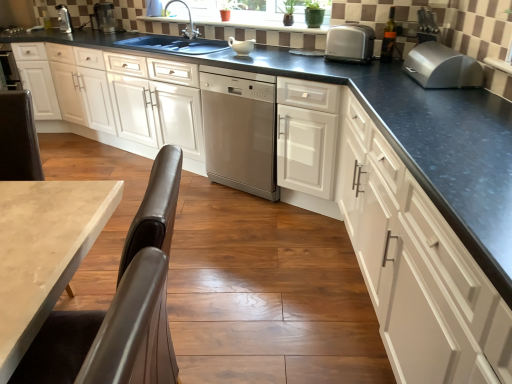
In order to click on free point to the left of metallic silver blender at upper left, placed as the 2th appliance when sorted from left to right in this screenshot , I will do pyautogui.click(x=90, y=35).